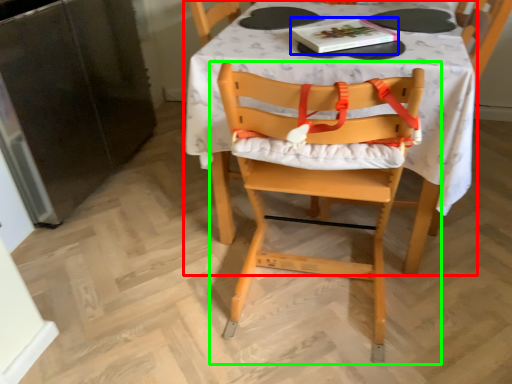
Question: Which object is the closest to the table (highlighted by a red box)? Choose among these: book (highlighted by a blue box) or chair (highlighted by a green box).

Choices:
 (A) book
 (B) chair

Answer: (B)